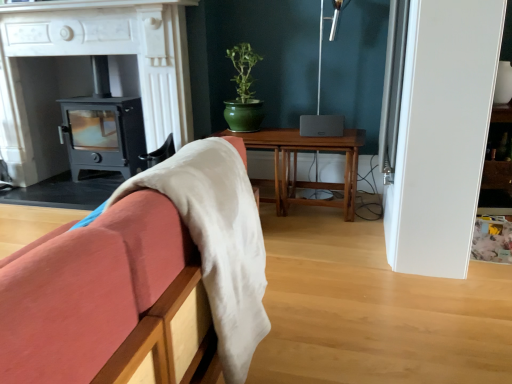
Question: Based on their positions, is wooden sofa at left located to the left or right of matte black wood burning stove at left?

Choices:
 (A) left
 (B) right

Answer: (B)

Question: Considering the positions of wooden sofa at left and matte black wood burning stove at left in the image, is wooden sofa at left bigger or smaller than matte black wood burning stove at left?

Choices:
 (A) small
 (B) big

Answer: (A)

Question: Estimate the real-world distances between objects in this image. Which object is farther from the wooden sofa at left?

Choices:
 (A) white marble fireplace at center
 (B) wooden table at center
 (C) matte black wood burning stove at left

Answer: (C)

Question: Which is farther from the wooden sofa at left?

Choices:
 (A) white marble fireplace at center
 (B) matte black wood burning stove at left
 (C) wooden table at center

Answer: (B)